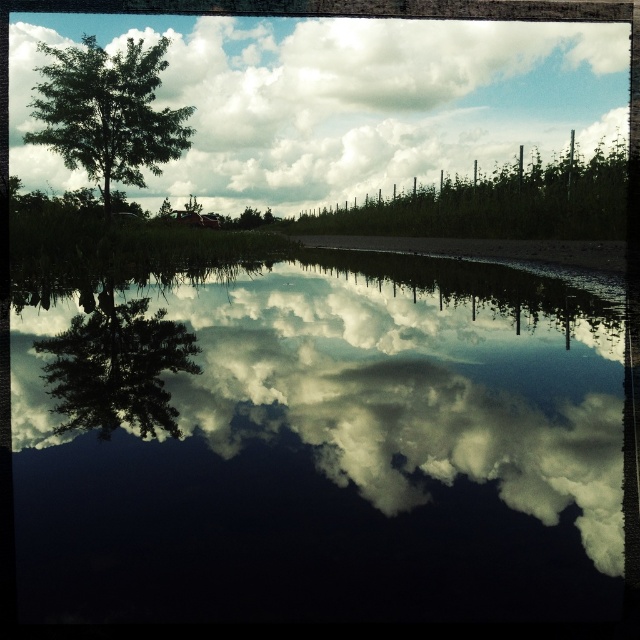
Looking at this image, can you confirm if green leafy tree at left is shorter than green matte tree at center?

Indeed, green leafy tree at left has a lesser height compared to green matte tree at center.

Is green leafy tree at left smaller than green matte tree at center?

Yes, green leafy tree at left is smaller than green matte tree at center.

Which is in front, point (177, 436) or point (244, 208)?

Point (177, 436) is more forward.

Find the location of `green leafy tree at left`. green leafy tree at left is located at coordinates (115, 369).

Who is more distant from viewer, (332, 451) or (192, 195)?

The point (192, 195) is more distant.

Which is in front, point (499, 332) or point (198, 204)?

Positioned in front is point (499, 332).

This screenshot has height=640, width=640. What are the coordinates of `glossy reflective water at center` in the screenshot? It's located at (352, 376).

Which is more to the right, green leafy tree at upper left or green matte tree at center?

green matte tree at center

Is green leafy tree at upper left behind green matte tree at center?

No, green leafy tree at upper left is closer to the viewer.

Between point (90, 179) and point (253, 220), which one is positioned behind?

The point (253, 220) is more distant.

You are a GUI agent. You are given a task and a screenshot of the screen. Output one action in this format:
    pyautogui.click(x=<x>, y=<y>)
    Task: Click on the green leafy tree at upper left
    The height and width of the screenshot is (640, 640).
    Given the screenshot: What is the action you would take?
    pyautogui.click(x=108, y=113)